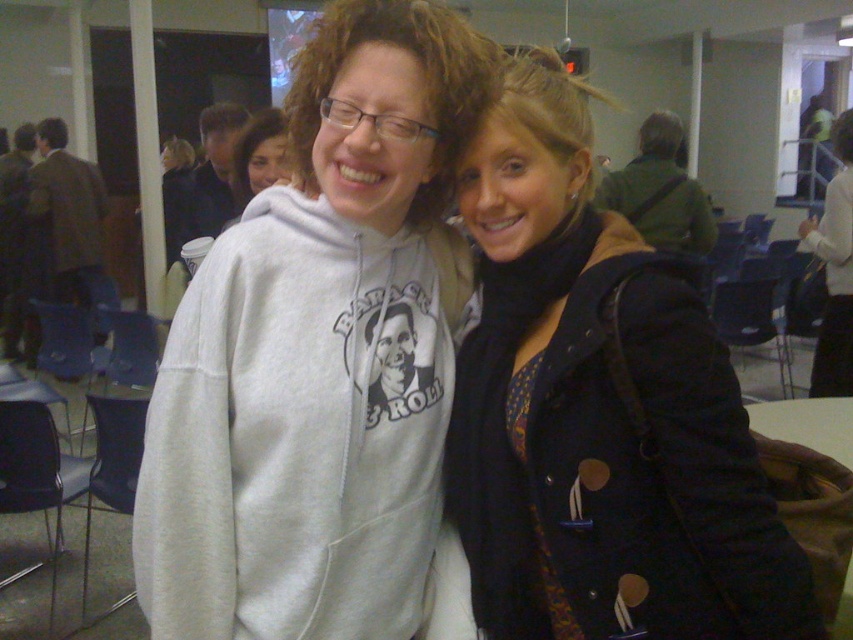
Is gray sweatshirt at center to the right of dark blue textured coat at center from the viewer's perspective?

Incorrect, gray sweatshirt at center is not on the right side of dark blue textured coat at center.

Can you confirm if gray sweatshirt at center is positioned below dark blue textured coat at center?

No.

Between point (238, 417) and point (480, 193), which one is positioned in front?

Point (238, 417)

Where is `gray sweatshirt at center`? This screenshot has height=640, width=853. gray sweatshirt at center is located at coordinates (318, 355).